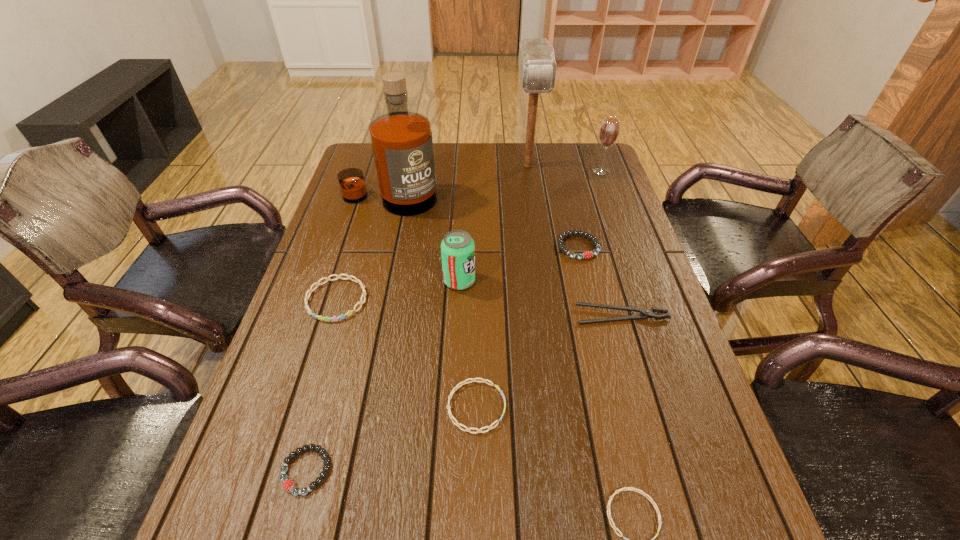
Where is `free region that satisfies the following two spatial constraints: 1. on the striking face of the mallet; 2. on the right side of the tongs`? The height and width of the screenshot is (540, 960). free region that satisfies the following two spatial constraints: 1. on the striking face of the mallet; 2. on the right side of the tongs is located at coordinates (549, 315).

Identify the location of vacant space that satisfies the following two spatial constraints: 1. on the striking face of the mallet; 2. on the left side of the bigger black bracelet. This screenshot has width=960, height=540. [x=540, y=247].